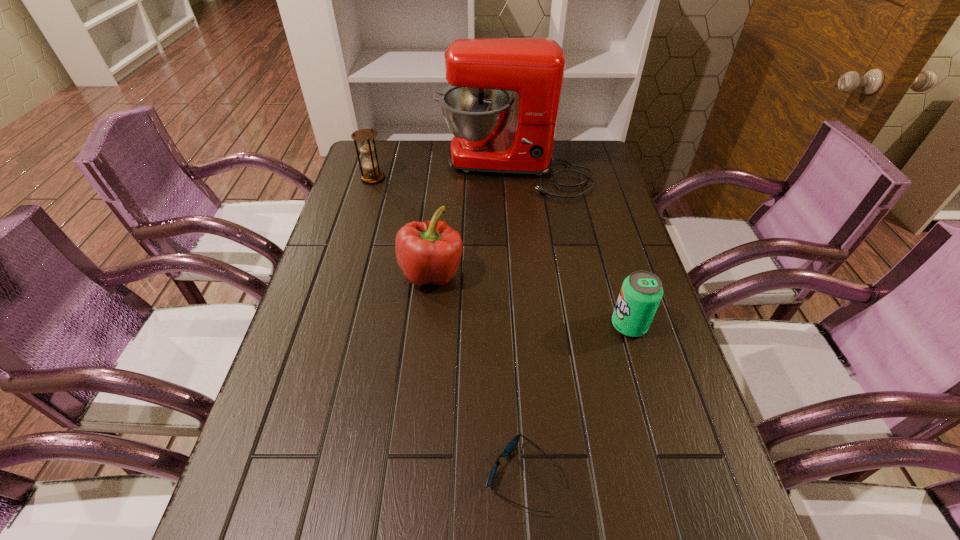
Identify the location of free spot that satisfies the following two spatial constraints: 1. on the front-facing side of the tallest object; 2. at the front of the shortest object showing the lenses. (542, 476).